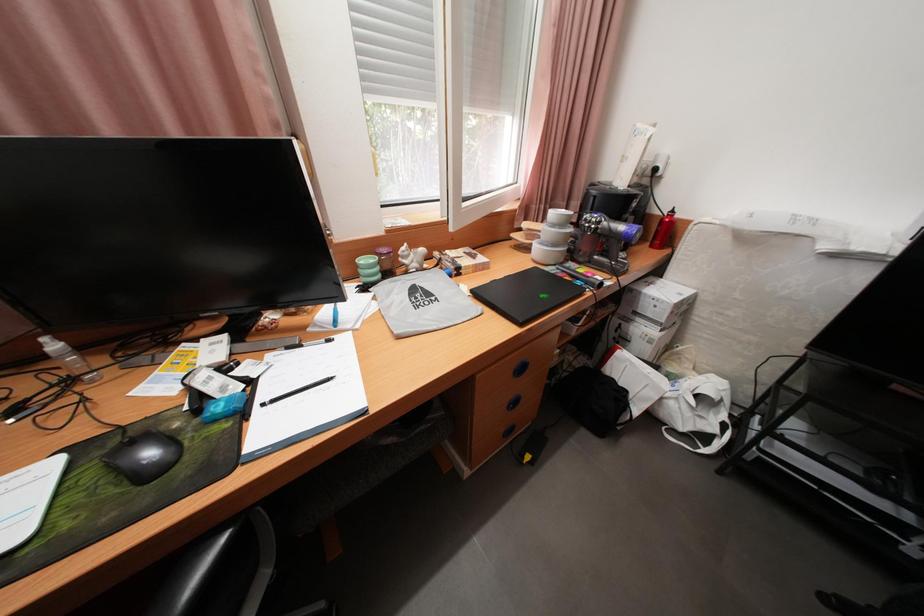
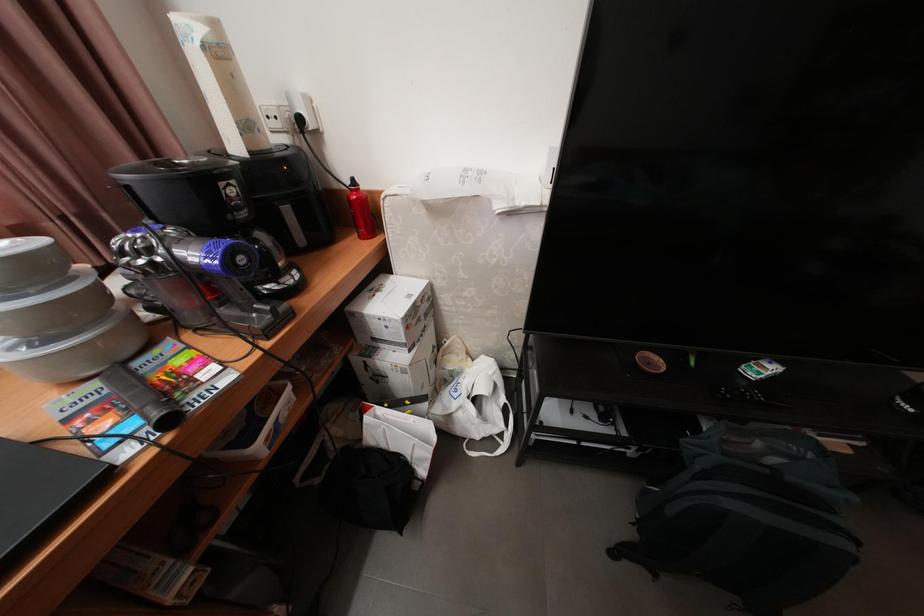
Question: The camera is either moving clockwise (left) or counter-clockwise (right) around the object. The first image is from the beginning of the video and the second image is from the end. Is the camera moving left or right when shooting the video?

Choices:
 (A) Left
 (B) Right

Answer: (A)